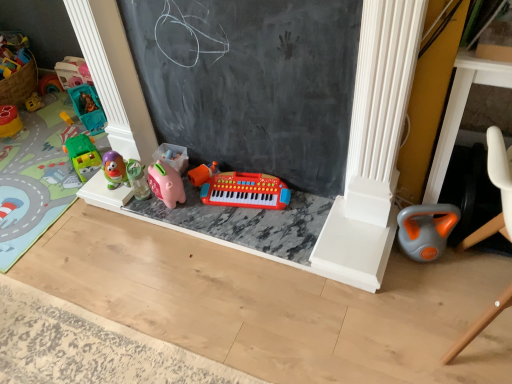
The image size is (512, 384). Describe the element at coordinates (9, 121) in the screenshot. I see `rubberized green car at left, which is counted as the 7th toy, starting from the right` at that location.

This screenshot has width=512, height=384. In order to click on pink rubber piggy bank at center, arranged as the 4th toy when viewed from the right in this screenshot , I will do `click(137, 179)`.

Where is `pink rubber piggy bank at center, which is the 5th toy from left to right`? The height and width of the screenshot is (384, 512). pink rubber piggy bank at center, which is the 5th toy from left to right is located at coordinates (166, 184).

What is the approximate height of black chalkboard at center?

The height of black chalkboard at center is 32.09 inches.

Where is `rubberized green car at left, which ranks as the first toy in left-to-right order`? rubberized green car at left, which ranks as the first toy in left-to-right order is located at coordinates (9, 121).

From a real-world perspective, who is located higher, black chalkboard at center or teal plastic toy truck at left, the sixth toy when ordered from right to left?

black chalkboard at center, from a real-world perspective.

From the image's perspective, does black chalkboard at center appear lower than teal plastic toy truck at left, the sixth toy when ordered from right to left?

Correct, black chalkboard at center appears lower than teal plastic toy truck at left, the sixth toy when ordered from right to left, in the image.

Who is shorter, black chalkboard at center or teal plastic toy truck at left, which ranks as the second toy in left-to-right order?

teal plastic toy truck at left, which ranks as the second toy in left-to-right order, is shorter.

In terms of height, does orange plastic toy car at lower right look taller or shorter compared to pink rubber piggy bank at center, which ranks as the fourth toy in left-to-right order?

Clearly, orange plastic toy car at lower right is taller compared to pink rubber piggy bank at center, which ranks as the fourth toy in left-to-right order.

From the image's perspective, would you say orange plastic toy car at lower right is shown under pink rubber piggy bank at center, arranged as the 4th toy when viewed from the right?

No, from the image's perspective, orange plastic toy car at lower right is not beneath pink rubber piggy bank at center, arranged as the 4th toy when viewed from the right.

Looking at this image, is orange plastic toy car at lower right inside or outside of pink rubber piggy bank at center, arranged as the 4th toy when viewed from the right?

The correct answer is: outside.

Does orange plastic toy car at lower right turn towards pink rubber piggy bank at center, which ranks as the fourth toy in left-to-right order?

No, orange plastic toy car at lower right does not turn towards pink rubber piggy bank at center, which ranks as the fourth toy in left-to-right order.

Is the position of gray-orange plastic kettlebell at lower right, which ranks as the first toy in right-to-left order, more distant than that of pink rubber piggy bank at center, which is the 5th toy from left to right?

No, it is in front of pink rubber piggy bank at center, which is the 5th toy from left to right.

From a real-world perspective, which is physically below, gray-orange plastic kettlebell at lower right, acting as the 7th toy starting from the left, or pink rubber piggy bank at center, acting as the 3th toy starting from the right?

gray-orange plastic kettlebell at lower right, acting as the 7th toy starting from the left.

From the image's perspective, which one is positioned higher, gray-orange plastic kettlebell at lower right, acting as the 7th toy starting from the left, or pink rubber piggy bank at center, which is the 5th toy from left to right?

From the image's view, pink rubber piggy bank at center, which is the 5th toy from left to right, is above.

Is gray-orange plastic kettlebell at lower right, which ranks as the first toy in right-to-left order, next to pink rubber piggy bank at center, acting as the 3th toy starting from the right, and touching it?

No, gray-orange plastic kettlebell at lower right, which ranks as the first toy in right-to-left order, is not in contact with pink rubber piggy bank at center, acting as the 3th toy starting from the right.

Is pink rubber piggy bank at center, which is the 5th toy from left to right, oriented away from black chalkboard at center?

Yes, black chalkboard at center is at the back of pink rubber piggy bank at center, which is the 5th toy from left to right.

Consider the image. From the image's perspective, is pink rubber piggy bank at center, which is the 5th toy from left to right, above black chalkboard at center?

No, from the image's perspective, pink rubber piggy bank at center, which is the 5th toy from left to right, is not above black chalkboard at center.

From a real-world perspective, is pink rubber piggy bank at center, acting as the 3th toy starting from the right, positioned above or below black chalkboard at center?

From a real-world perspective, pink rubber piggy bank at center, acting as the 3th toy starting from the right, is physically below black chalkboard at center.

Where is `bulletin board that is in front of the pink rubber piggy bank at center, acting as the 3th toy starting from the right`? The image size is (512, 384). bulletin board that is in front of the pink rubber piggy bank at center, acting as the 3th toy starting from the right is located at coordinates (251, 82).

From a real-world perspective, which is physically below, rubberized plastic keyboard at center, which is the second toy in right-to-left order, or pink rubber piggy bank at center, acting as the 3th toy starting from the right?

rubberized plastic keyboard at center, which is the second toy in right-to-left order, is physically lower.

Does rubberized plastic keyboard at center, the 6th toy positioned from the left, have a lesser height compared to pink rubber piggy bank at center, which is the 5th toy from left to right?

Yes.

Which point is more forward, (226, 197) or (172, 184)?

The point (172, 184) is closer.

From the image's perspective, which one is positioned higher, rubberized plastic keyboard at center, the 6th toy positioned from the left, or pink rubber piggy bank at center, acting as the 3th toy starting from the right?

pink rubber piggy bank at center, acting as the 3th toy starting from the right, is shown above in the image.

Is pink rubber piggy bank at center, arranged as the 4th toy when viewed from the right, oriented away from green plastic car at left, marked as the third toy in a left-to-right arrangement?

pink rubber piggy bank at center, arranged as the 4th toy when viewed from the right, does not have its back to green plastic car at left, marked as the third toy in a left-to-right arrangement.

From the image's perspective, does pink rubber piggy bank at center, which ranks as the fourth toy in left-to-right order, appear lower than green plastic car at left, marked as the third toy in a left-to-right arrangement?

Yes.

From a real-world perspective, which is physically below, pink rubber piggy bank at center, arranged as the 4th toy when viewed from the right, or green plastic car at left, marked as the third toy in a left-to-right arrangement?

green plastic car at left, marked as the third toy in a left-to-right arrangement, is physically lower.

Which of these two, pink rubber piggy bank at center, arranged as the 4th toy when viewed from the right, or green plastic car at left, marked as the third toy in a left-to-right arrangement, is bigger?

With larger size is green plastic car at left, marked as the third toy in a left-to-right arrangement.

Between orange plastic toy car at lower right and pink rubber piggy bank at center, acting as the 3th toy starting from the right, which one appears on the left side from the viewer's perspective?

pink rubber piggy bank at center, acting as the 3th toy starting from the right.

Can you tell me how much orange plastic toy car at lower right and pink rubber piggy bank at center, which is the 5th toy from left to right, differ in facing direction?

2.51e-05 degrees.

Considering the sizes of objects orange plastic toy car at lower right and pink rubber piggy bank at center, which is the 5th toy from left to right, in the image provided, who is taller, orange plastic toy car at lower right or pink rubber piggy bank at center, which is the 5th toy from left to right,?

orange plastic toy car at lower right is taller.

Considering the sizes of objects orange plastic toy car at lower right and pink rubber piggy bank at center, acting as the 3th toy starting from the right, in the image provided, who is thinner, orange plastic toy car at lower right or pink rubber piggy bank at center, acting as the 3th toy starting from the right,?

With smaller width is pink rubber piggy bank at center, acting as the 3th toy starting from the right.

I want to click on bulletin board lying on the right of teal plastic toy truck at left, the sixth toy when ordered from right to left, so click(x=251, y=82).

Identify the location of table in front of the pink rubber piggy bank at center, arranged as the 4th toy when viewed from the right. Image resolution: width=512 pixels, height=384 pixels. (461, 111).

Based on their spatial positions, is black chalkboard at center or rubberized plastic keyboard at center, the 6th toy positioned from the left, closer to green plastic car at left, marked as the third toy in a left-to-right arrangement?

rubberized plastic keyboard at center, the 6th toy positioned from the left, lies closer to green plastic car at left, marked as the third toy in a left-to-right arrangement, than the other object.

Which object lies nearer to the anchor point orange plastic toy car at lower right, gray-orange plastic kettlebell at lower right, which ranks as the first toy in right-to-left order, or black chalkboard at center?

gray-orange plastic kettlebell at lower right, which ranks as the first toy in right-to-left order, is closer to orange plastic toy car at lower right.

Based on their spatial positions, is black chalkboard at center or rubberized green car at left, which is counted as the 7th toy, starting from the right, further from orange plastic toy car at lower right?

The object further to orange plastic toy car at lower right is rubberized green car at left, which is counted as the 7th toy, starting from the right.

Which object lies nearer to the anchor point black chalkboard at center, green plastic car at left, the 5th toy when ordered from right to left, or gray-orange plastic kettlebell at lower right, which ranks as the first toy in right-to-left order?

gray-orange plastic kettlebell at lower right, which ranks as the first toy in right-to-left order, is positioned closer to the anchor black chalkboard at center.

Based on their spatial positions, is rubberized green car at left, which is counted as the 7th toy, starting from the right, or orange plastic toy car at lower right further from rubberized plastic keyboard at center, which is the second toy in right-to-left order?

rubberized green car at left, which is counted as the 7th toy, starting from the right, lies further to rubberized plastic keyboard at center, which is the second toy in right-to-left order, than the other object.

Considering their positions, is rubberized plastic keyboard at center, the 6th toy positioned from the left, positioned further to teal plastic toy truck at left, the sixth toy when ordered from right to left, than gray-orange plastic kettlebell at lower right, which ranks as the first toy in right-to-left order?

Based on the image, gray-orange plastic kettlebell at lower right, which ranks as the first toy in right-to-left order, appears to be further to teal plastic toy truck at left, the sixth toy when ordered from right to left.

Based on the photo, which object lies further to the anchor point black chalkboard at center, gray-orange plastic kettlebell at lower right, which ranks as the first toy in right-to-left order, or pink rubber piggy bank at center, acting as the 3th toy starting from the right?

gray-orange plastic kettlebell at lower right, which ranks as the first toy in right-to-left order, is further to black chalkboard at center.

Looking at the image, which one is located closer to rubberized plastic keyboard at center, which is the second toy in right-to-left order, orange plastic toy car at lower right or teal plastic toy truck at left, the sixth toy when ordered from right to left?

orange plastic toy car at lower right.

Identify the location of bulletin board between teal plastic toy truck at left, the sixth toy when ordered from right to left, and rubberized plastic keyboard at center, the 6th toy positioned from the left. (251, 82).

What are the coordinates of `bulletin board between pink rubber piggy bank at center, arranged as the 4th toy when viewed from the right, and orange plastic toy car at lower right, in the horizontal direction` in the screenshot? It's located at (251, 82).

This screenshot has height=384, width=512. I want to click on bulletin board located between rubberized green car at left, which is counted as the 7th toy, starting from the right, and rubberized plastic keyboard at center, the 6th toy positioned from the left, in the left-right direction, so click(x=251, y=82).

The width and height of the screenshot is (512, 384). In order to click on bulletin board located between teal plastic toy truck at left, the sixth toy when ordered from right to left, and orange plastic toy car at lower right in the left-right direction in this screenshot , I will do `click(251, 82)`.